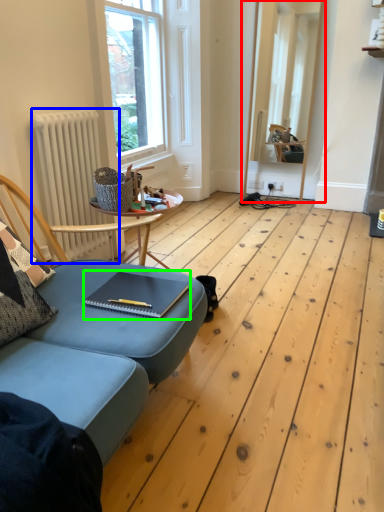
Question: Based on their relative distances, which object is nearer to window frame (highlighted by a red box)? Choose from radiator (highlighted by a blue box) and notebook (highlighted by a green box).

Choices:
 (A) radiator
 (B) notebook

Answer: (A)